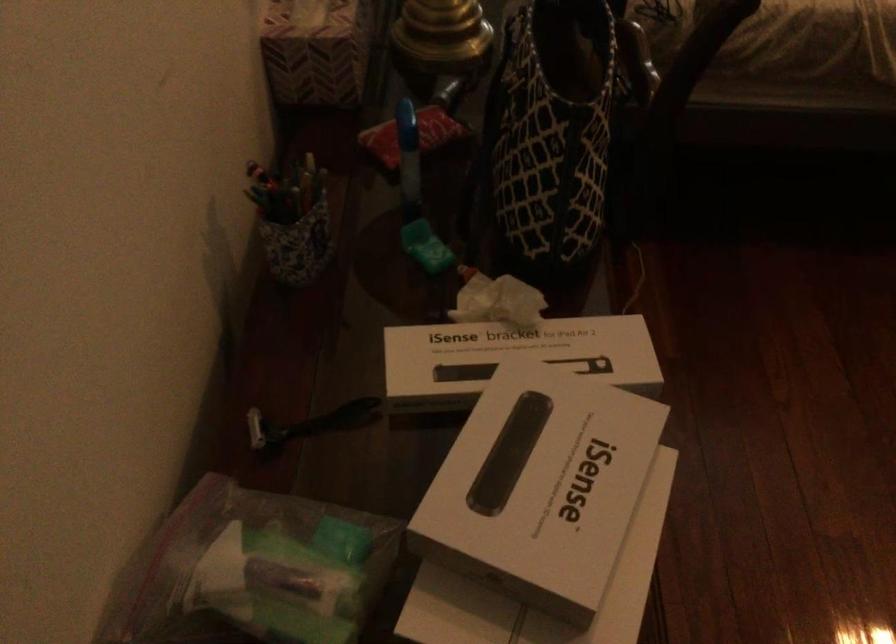
You are a GUI agent. You are given a task and a screenshot of the screen. Output one action in this format:
    pyautogui.click(x=<x>, y=<y>)
    Task: Click on the black handle tool
    The width and height of the screenshot is (896, 644).
    Given the screenshot: What is the action you would take?
    pyautogui.click(x=309, y=422)